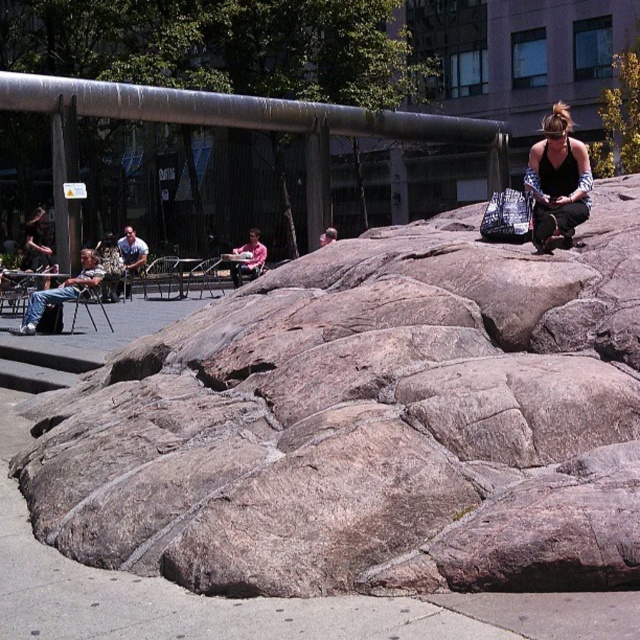
Does point (536, 237) come in front of point (90, 273)?

Yes, point (536, 237) is in front of point (90, 273).

Is matte black tank top at upper right to the left of matte gray chair at left from the viewer's perspective?

In fact, matte black tank top at upper right is to the right of matte gray chair at left.

Describe the element at coordinates (557, 180) in the screenshot. I see `matte black tank top at upper right` at that location.

Where is `matte black tank top at upper right`? Image resolution: width=640 pixels, height=640 pixels. matte black tank top at upper right is located at coordinates (557, 180).

What do you see at coordinates (369, 422) in the screenshot? I see `gray rough rock at center` at bounding box center [369, 422].

Can you confirm if gray rough rock at center is shorter than matte black tank top at upper right?

Indeed, gray rough rock at center has a lesser height compared to matte black tank top at upper right.

Measure the distance between gray rough rock at center and camera.

gray rough rock at center and camera are 4.47 meters apart.

Find the location of a particular element. Image resolution: width=640 pixels, height=640 pixels. gray rough rock at center is located at coordinates (369, 422).

In the scene shown: Between matte black tank top at upper right and pink fabric stroller at center, which one has less height?

pink fabric stroller at center

Which is above, matte black tank top at upper right or pink fabric stroller at center?

matte black tank top at upper right

Is point (544, 179) behind point (253, 259)?

No, (544, 179) is closer to viewer.

At what (x,y) coordinates should I click in order to perform the action: click on matte black tank top at upper right. Please return your answer as a coordinate pair (x, y). This screenshot has height=640, width=640. Looking at the image, I should click on (557, 180).